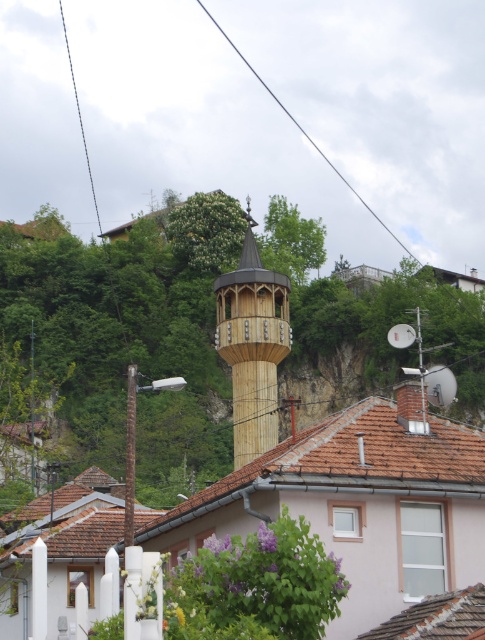
You are standing at the point with coordinates (253, 344) in the image. What structure are you currently located at?

The point at coordinates (253, 344) corresponds to the wooden minaret at center.

You are a drone operator trying to capture a photo of the wooden minaret at center from above. The black wire at upper center is blocking your shot. What is the minimum distance you need to move your drone to the side to avoid the wire?

The wooden minaret at center is 181.45 meters from the black wire at upper center. To avoid the wire, the drone must move at least 181.45 meters to the side.